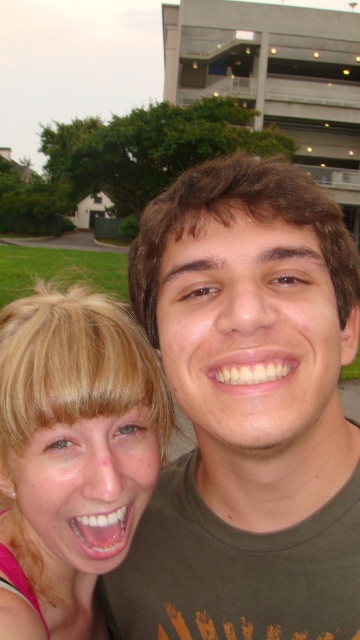
Question: Is matte green t-shirt at center behind blonde hair at left?

Choices:
 (A) yes
 (B) no

Answer: (B)

Question: Is the position of matte green t-shirt at center more distant than that of blonde hair at left?

Choices:
 (A) no
 (B) yes

Answer: (A)

Question: Can you confirm if matte green t-shirt at center is thinner than blonde hair at left?

Choices:
 (A) yes
 (B) no

Answer: (B)

Question: Among these objects, which one is farthest from the camera?

Choices:
 (A) matte green t-shirt at center
 (B) blonde hair at left

Answer: (B)

Question: Which point appears closest to the camera in this image?

Choices:
 (A) (136, 458)
 (B) (294, 605)

Answer: (B)